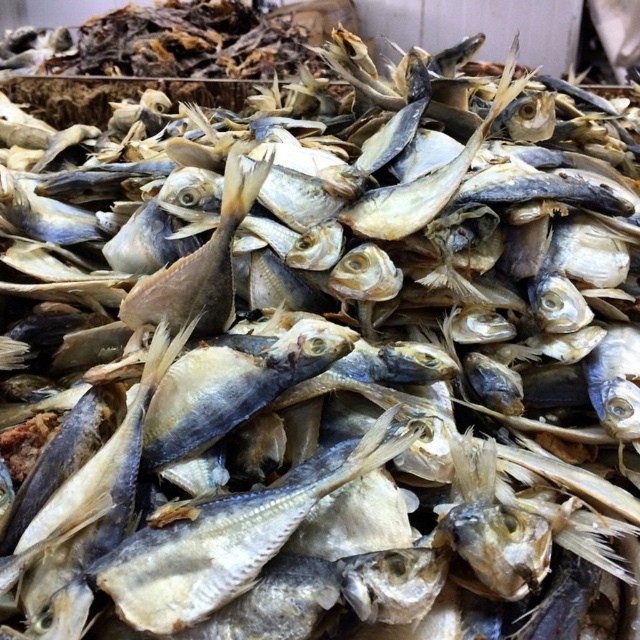
Question: Does shiny silver fish at center have a larger size compared to light brown dried fish at center?

Choices:
 (A) no
 (B) yes

Answer: (A)

Question: Is shiny silver fish at center closer to the viewer compared to light brown dried fish at center?

Choices:
 (A) yes
 (B) no

Answer: (A)

Question: Which point is closer to the camera taking this photo?

Choices:
 (A) (154, 282)
 (B) (364, 442)

Answer: (B)

Question: Does shiny silver fish at center appear on the left side of light brown dried fish at center?

Choices:
 (A) yes
 (B) no

Answer: (B)

Question: Which of the following is the closest to the observer?

Choices:
 (A) light brown dried fish at center
 (B) shiny silver fish at center

Answer: (B)